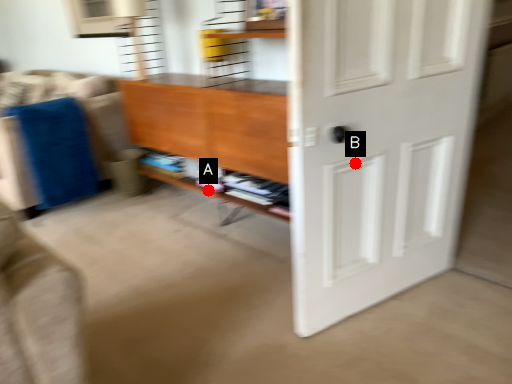
Question: Two points are circled on the image, labeled by A and B beside each circle. Among these points, which one is nearest to the camera?

Choices:
 (A) A is closer
 (B) B is closer

Answer: (B)